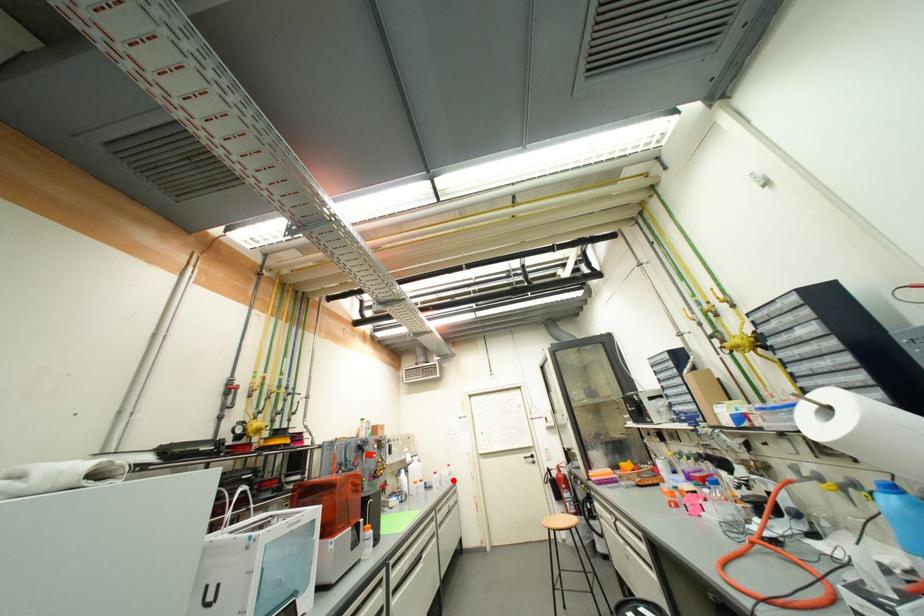
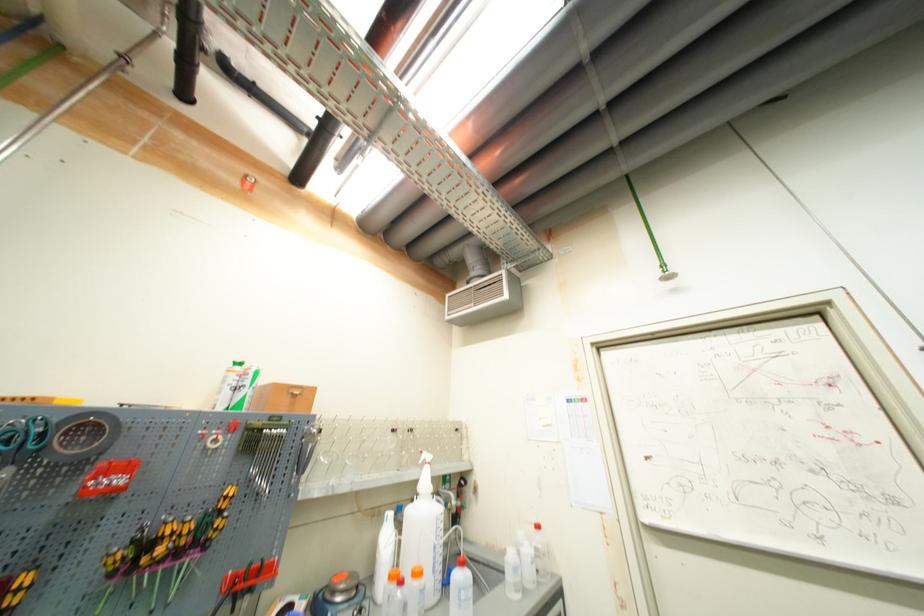
Question: A red point is marked in image1. In image2, is the corresponding 3D point closer to the camera or farther? Reply with the corresponding letter.

Choices:
 (A) The corresponding 3D point is closer.
 (B) The corresponding 3D point is farther.

Answer: (A)